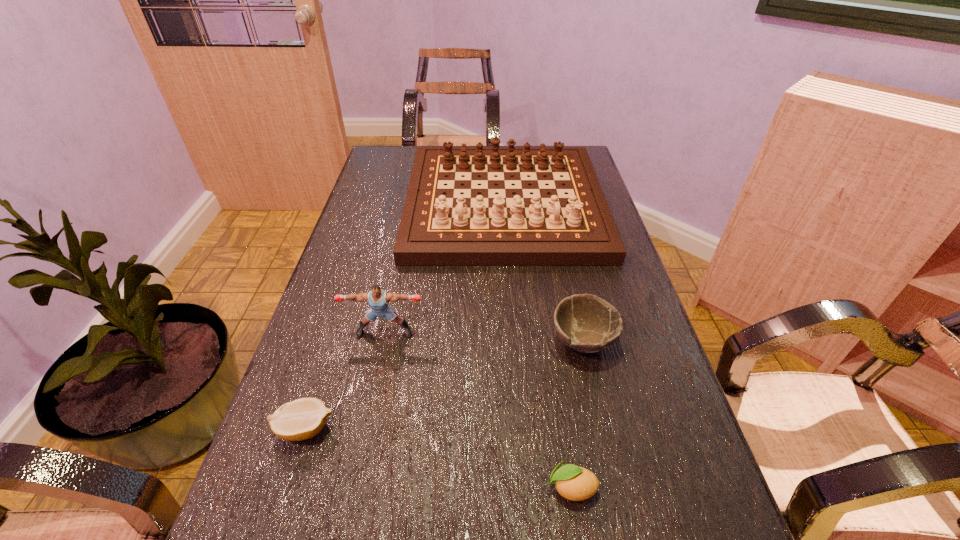
Find the location of `object positioned at the far left corner`. object positioned at the far left corner is located at coordinates (563, 219).

The height and width of the screenshot is (540, 960). In order to click on object located in the far right corner section of the desktop in this screenshot , I will do `click(563, 219)`.

The width and height of the screenshot is (960, 540). In order to click on free space at the left edge of the desktop in this screenshot , I will do `click(378, 188)`.

In the image, there is a desktop. Where is `blank space at the right edge`? Image resolution: width=960 pixels, height=540 pixels. blank space at the right edge is located at coordinates (572, 291).

I want to click on blank region between the right lemon and the farthest object, so click(538, 346).

The width and height of the screenshot is (960, 540). Find the location of `unoccupied position between the left lemon and the nearer lemon`. unoccupied position between the left lemon and the nearer lemon is located at coordinates (438, 458).

Identify the location of empty space that is in between the third tallest object and the nearer lemon. The image size is (960, 540). (x=577, y=415).

Where is `vacant region between the gameboard and the nearer lemon`? Image resolution: width=960 pixels, height=540 pixels. vacant region between the gameboard and the nearer lemon is located at coordinates (538, 346).

Identify the location of blank region between the bowl and the gameboard. This screenshot has height=540, width=960. (543, 273).

Locate an element on the screen. vacant space that is in between the puncher and the left lemon is located at coordinates (345, 380).